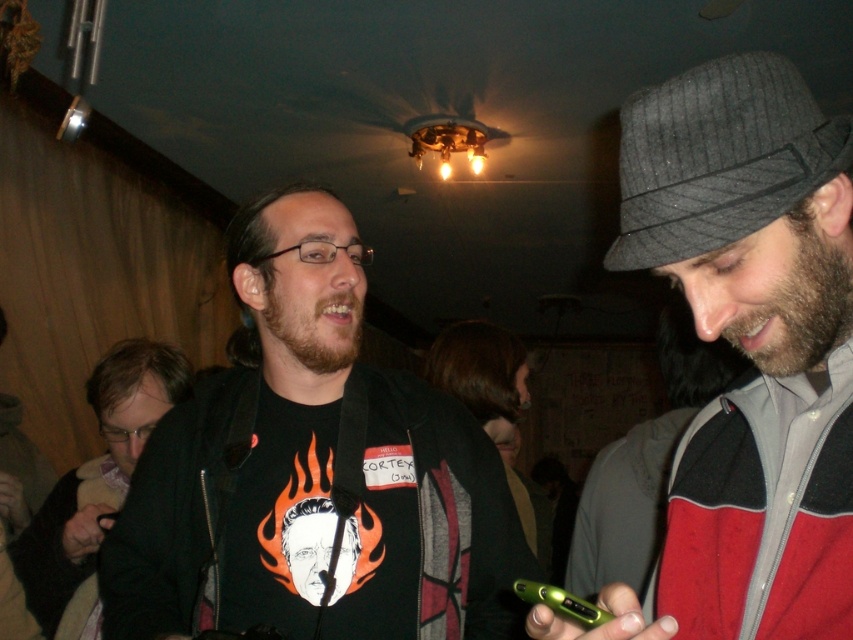
Can you confirm if matte black t-shirt with flame design at center is bigger than matte black jacket at left?

Actually, matte black t-shirt with flame design at center might be smaller than matte black jacket at left.

Which is more to the left, matte black t-shirt with flame design at center or matte black jacket at left?

Positioned to the left is matte black jacket at left.

Which is in front, point (209, 604) or point (155, 340)?

Point (209, 604) is in front.

This screenshot has width=853, height=640. In order to click on matte black t-shirt with flame design at center in this screenshot , I will do `click(312, 474)`.

Does gray wool hat at right lie behind matte black jacket at left?

No, it is in front of matte black jacket at left.

Does gray wool hat at right have a greater width compared to matte black jacket at left?

Incorrect, gray wool hat at right's width does not surpass matte black jacket at left's.

At what (x,y) coordinates should I click in order to perform the action: click on gray wool hat at right. Please return your answer as a coordinate pair (x, y). Looking at the image, I should click on (747, 349).

Is matte black t-shirt with flame design at center in front of gray wool hat at right?

No, matte black t-shirt with flame design at center is further to the viewer.

Which is behind, point (201, 612) or point (682, 225)?

The point (201, 612) is more distant.

Image resolution: width=853 pixels, height=640 pixels. What are the coordinates of `matte black t-shirt with flame design at center` in the screenshot? It's located at (312, 474).